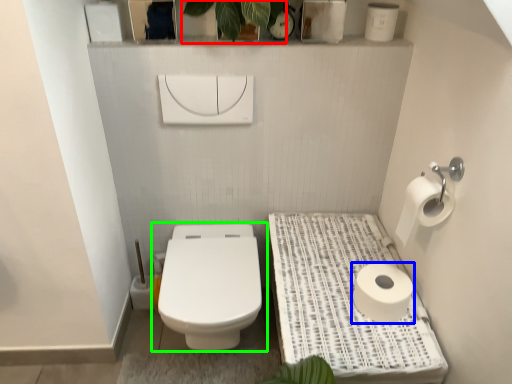
Question: Which object is positioned farthest from plant (highlighted by a red box)? Select from toilet paper (highlighted by a blue box) and toilet (highlighted by a green box).

Choices:
 (A) toilet paper
 (B) toilet

Answer: (A)